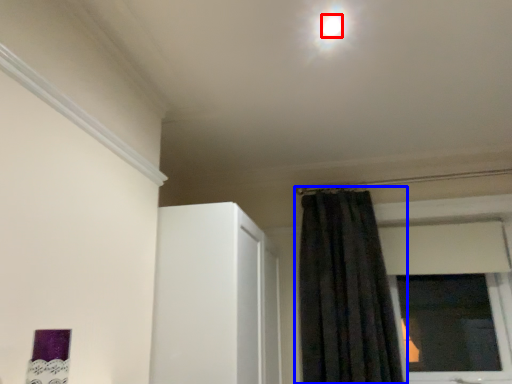
Question: Among these objects, which one is nearest to the camera, light (highlighted by a red box) or curtain (highlighted by a blue box)?

Choices:
 (A) light
 (B) curtain

Answer: (A)